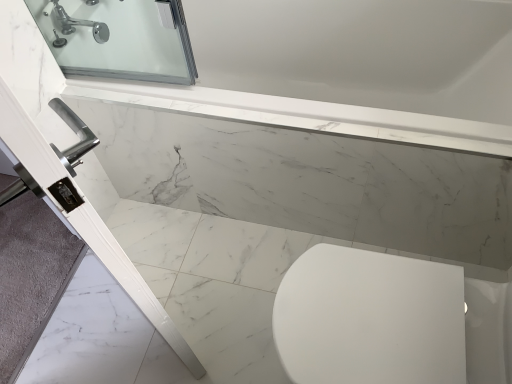
Question: Is chrome metallic faucet at upper left shorter than white glossy bathtub at lower left?

Choices:
 (A) no
 (B) yes

Answer: (A)

Question: Does chrome metallic faucet at upper left lie behind white glossy bathtub at lower left?

Choices:
 (A) yes
 (B) no

Answer: (A)

Question: Does chrome metallic faucet at upper left have a larger size compared to white glossy bathtub at lower left?

Choices:
 (A) no
 (B) yes

Answer: (A)

Question: Does chrome metallic faucet at upper left have a lesser width compared to white glossy bathtub at lower left?

Choices:
 (A) no
 (B) yes

Answer: (B)

Question: Is chrome metallic faucet at upper left positioned before white glossy bathtub at lower left?

Choices:
 (A) yes
 (B) no

Answer: (B)

Question: Are chrome metallic faucet at upper left and white glossy bathtub at lower left located far from each other?

Choices:
 (A) no
 (B) yes

Answer: (A)

Question: Is white glossy bathtub at lower left facing towards chrome metallic faucet at upper left?

Choices:
 (A) yes
 (B) no

Answer: (B)

Question: Is white glossy bathtub at lower left positioned with its back to chrome metallic faucet at upper left?

Choices:
 (A) yes
 (B) no

Answer: (B)

Question: From a real-world perspective, is white glossy bathtub at lower left on top of chrome metallic faucet at upper left?

Choices:
 (A) yes
 (B) no

Answer: (B)

Question: Does white glossy bathtub at lower left have a lesser height compared to chrome metallic faucet at upper left?

Choices:
 (A) yes
 (B) no

Answer: (A)

Question: Can you confirm if white glossy bathtub at lower left is positioned to the left of chrome metallic faucet at upper left?

Choices:
 (A) yes
 (B) no

Answer: (B)

Question: Considering the relative sizes of white glossy bathtub at lower left and chrome metallic faucet at upper left in the image provided, is white glossy bathtub at lower left bigger than chrome metallic faucet at upper left?

Choices:
 (A) no
 (B) yes

Answer: (B)

Question: From the image's perspective, is chrome metallic faucet at upper left above or below white glossy bathtub at lower left?

Choices:
 (A) below
 (B) above

Answer: (B)